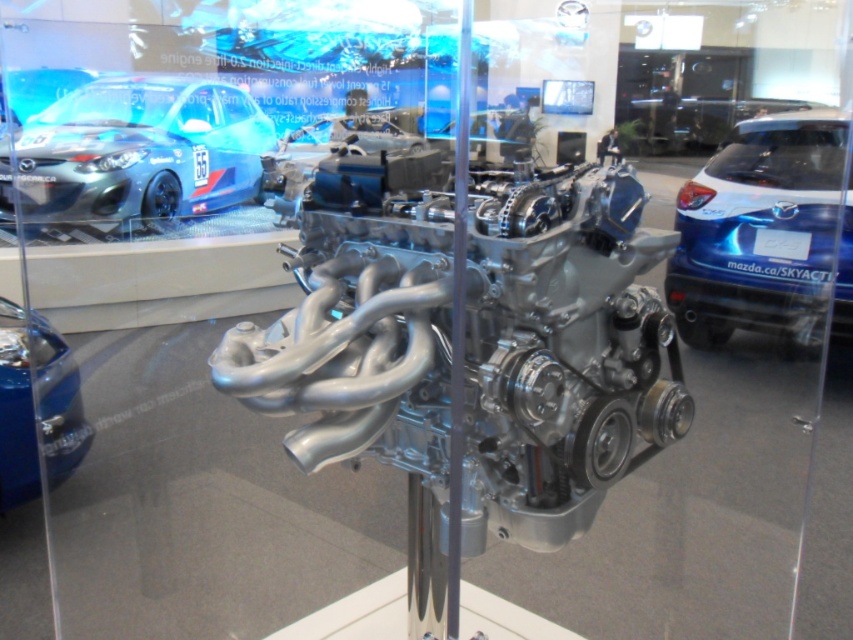
You are a photographer trying to capture the engine in the glass enclosure. You notice two points marked on the engine at coordinates point (648, 307) and point (809, 218). Which point is closer to your camera lens?

Point (648, 307) is closer to the camera than point (809, 218), so the photographer should focus on that point first to ensure clarity.

You are standing in front of the glass enclosure holding a camera. You want to take a photo of the polished silver engine at center. The camera requires a minimum distance of 4 feet to focus properly. Will you be able to take a clear photo from your current position?

The polished silver engine at center and camera are 3.70 feet apart from each other. Since the minimum focusing distance is 4 feet, you are too close to take a clear photo. Move back to ensure the camera is at least 4 feet away.